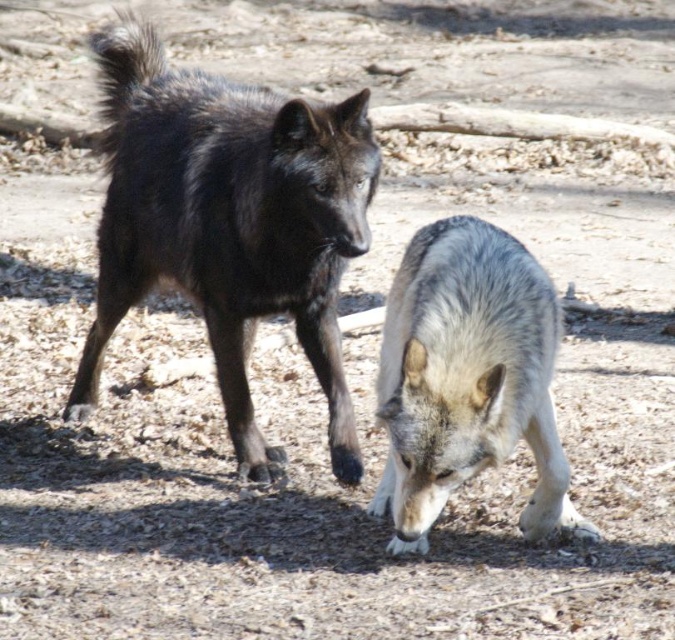
Question: Can you confirm if shiny black fur at center is positioned below gray fur wolf at lower center?

Choices:
 (A) yes
 (B) no

Answer: (B)

Question: Is shiny black fur at center to the right of gray fur wolf at lower center from the viewer's perspective?

Choices:
 (A) no
 (B) yes

Answer: (A)

Question: Does shiny black fur at center have a smaller size compared to gray fur wolf at lower center?

Choices:
 (A) no
 (B) yes

Answer: (A)